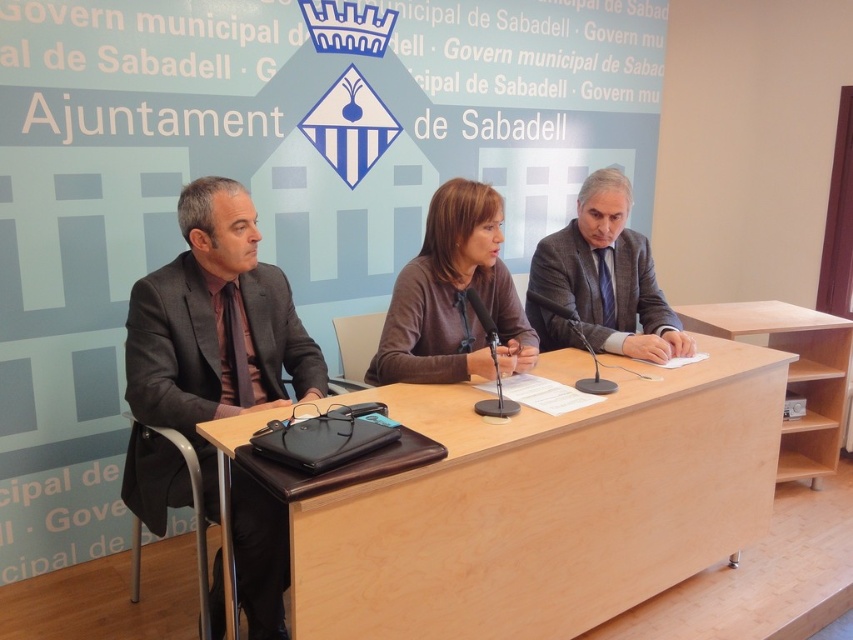
Question: Considering the real-world distances, which object is closest to the light brown wood table at center?

Choices:
 (A) brown matte sweater at center
 (B) dark gray suit at center

Answer: (A)

Question: Is dark gray suit at center wider than dark gray wool suit at right?

Choices:
 (A) yes
 (B) no

Answer: (A)

Question: Among these points, which one is farthest from the camera?

Choices:
 (A) (560, 236)
 (B) (279, 584)
 (C) (502, 284)

Answer: (A)

Question: Does brown matte sweater at center have a lesser width compared to dark gray wool suit at right?

Choices:
 (A) no
 (B) yes

Answer: (B)

Question: Among these objects, which one is nearest to the camera?

Choices:
 (A) light brown wood table at center
 (B) dark gray suit at center
 (C) dark gray wool suit at right
 (D) brown matte sweater at center

Answer: (A)

Question: Is the position of light brown wood table at center less distant than that of dark gray suit at center?

Choices:
 (A) no
 (B) yes

Answer: (B)